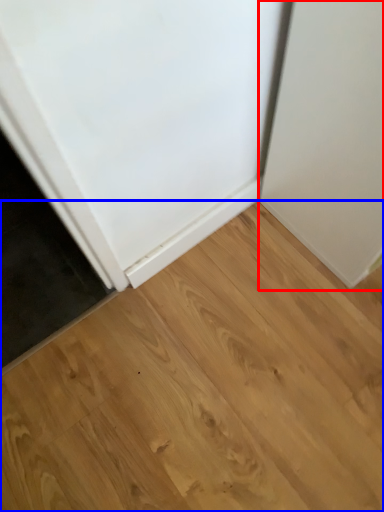
Question: Which object appears closest to the camera in this image, door (highlighted by a red box) or hardwood (highlighted by a blue box)?

Choices:
 (A) door
 (B) hardwood

Answer: (A)